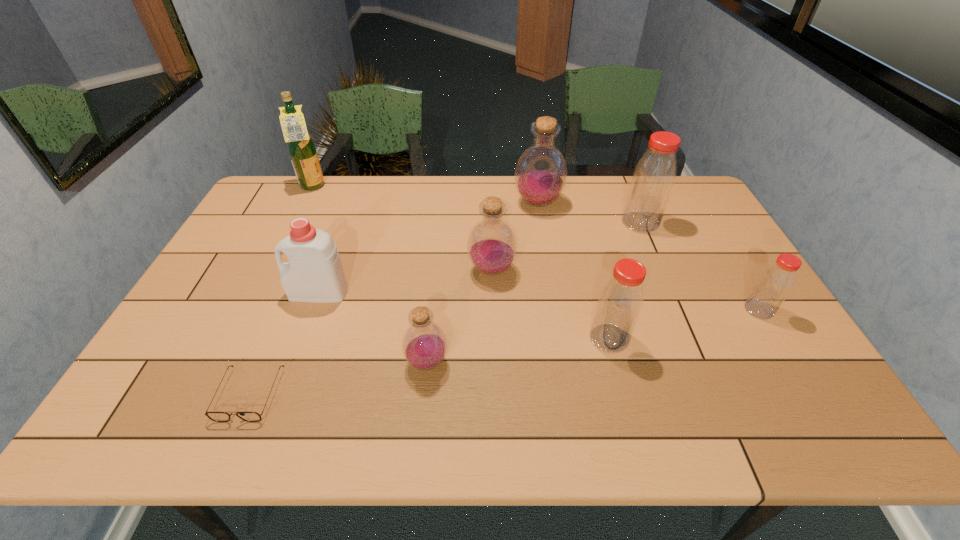
At what (x,y) coordinates should I click in order to perform the action: click on free space that satisfies the following two spatial constraints: 1. on the front-facing side of the leftmost purple bottle; 2. on the right side of the liquor. Please return your answer as a coordinate pair (x, y). The image size is (960, 540). Looking at the image, I should click on (226, 362).

This screenshot has width=960, height=540. What are the coordinates of `blank area in the image that satisfies the following two spatial constraints: 1. on the back side of the nearest purple bottle; 2. on the front-facing side of the liquor` in the screenshot? It's located at (445, 187).

Identify the location of vacant region that satisfies the following two spatial constraints: 1. on the handle side of the leftmost red bottle; 2. on the right side of the white detergent. (302, 338).

Where is `vacant area that satisfies the following two spatial constraints: 1. on the back side of the biggest red bottle; 2. on the front-facing side of the liquor`? Image resolution: width=960 pixels, height=540 pixels. vacant area that satisfies the following two spatial constraints: 1. on the back side of the biggest red bottle; 2. on the front-facing side of the liquor is located at coordinates (625, 187).